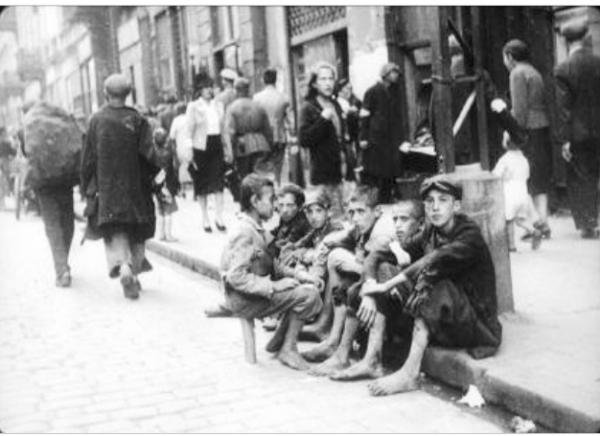
I want to click on trash, so click(468, 398), click(523, 425).